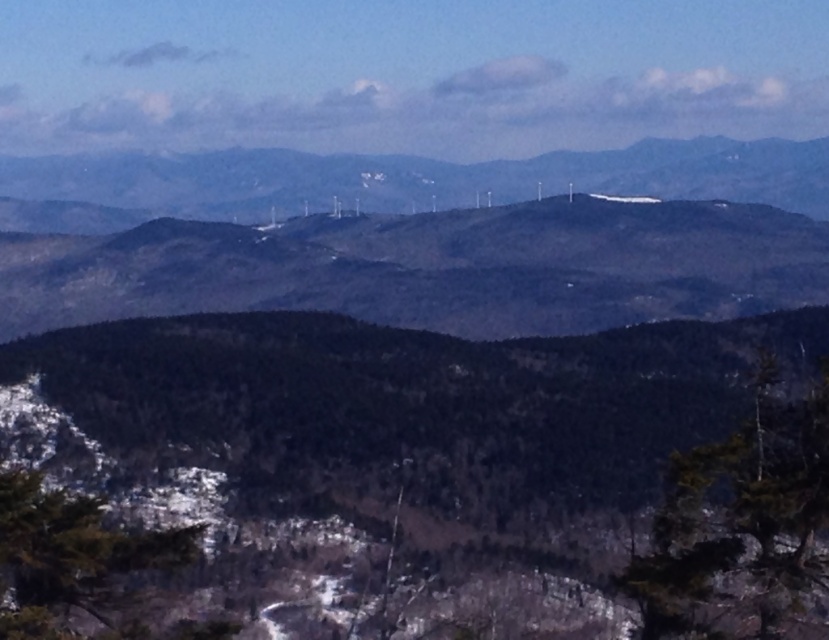
Is green matte tree at center positioned before green textured tree at lower right?

No, it is not.

Between point (822, 330) and point (764, 349), which one is positioned behind?

Positioned behind is point (822, 330).

The image size is (829, 640). Describe the element at coordinates (389, 451) in the screenshot. I see `green matte tree at center` at that location.

At what (x,y) coordinates should I click in order to perform the action: click on green matte tree at center. Please return your answer as a coordinate pair (x, y). The width and height of the screenshot is (829, 640). Looking at the image, I should click on (389, 451).